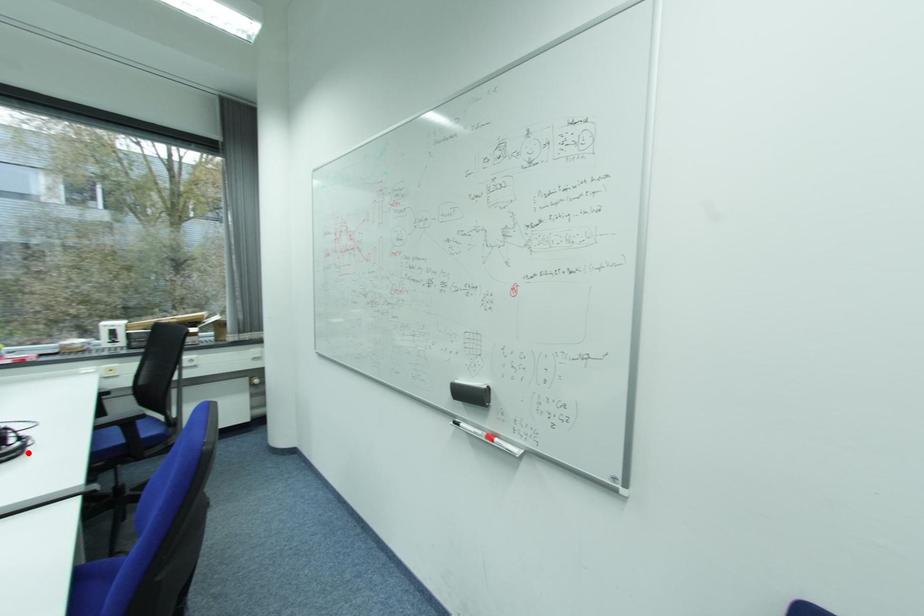
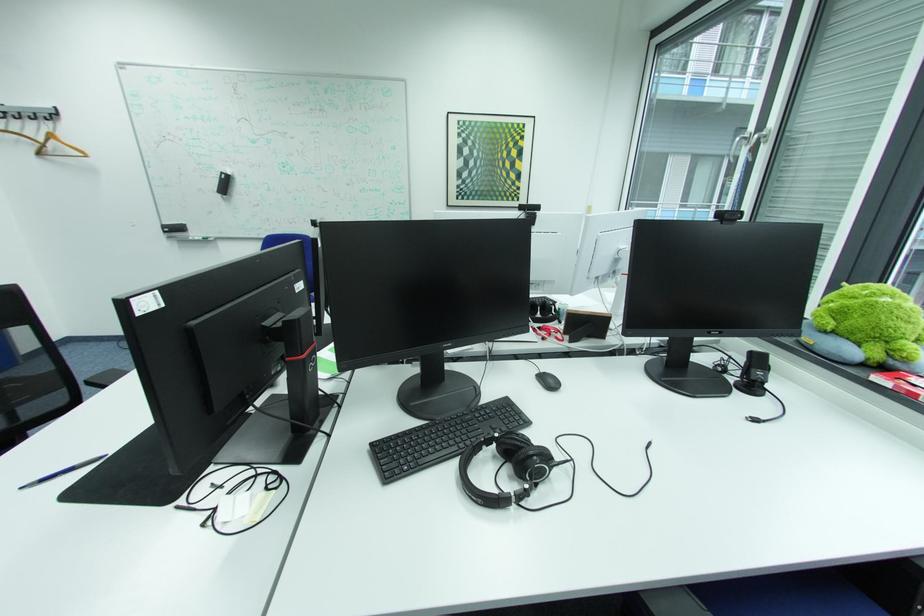
Question: I am providing you with two images of the same scene from different viewpoints. Given a red point in image1, look at the same physical point in image2. Is it:

Choices:
 (A) Closer to the viewpoint
 (B) Farther from the viewpoint

Answer: (A)